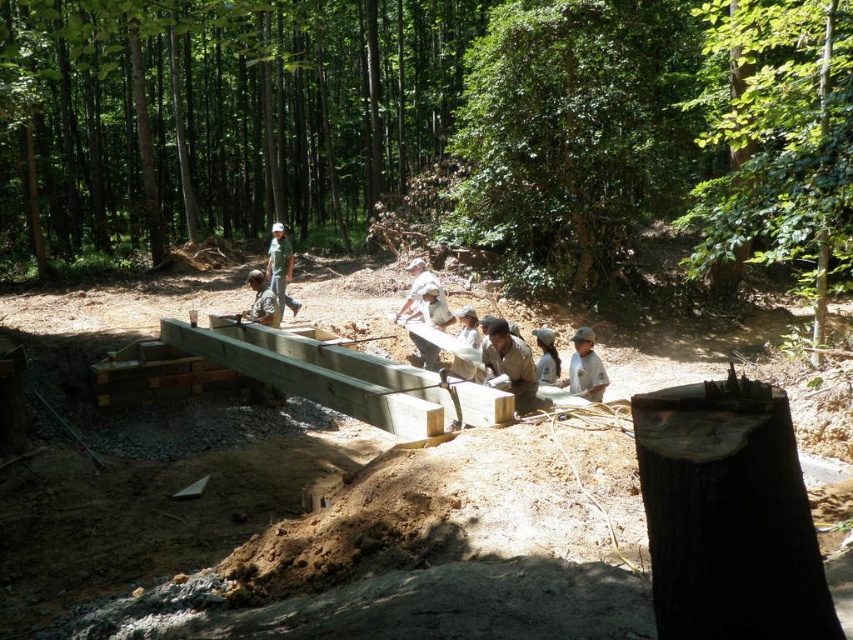
You are planning to take a photo of the green leafy forest at center and the dark brown wood at lower right. Which object should you focus on first if you want to capture both in a single frame without moving the camera?

The green leafy forest at center is bigger than the dark brown wood at lower right, so you should focus on the green leafy forest at center first to ensure it fills the frame appropriately before adjusting for the smaller dark brown wood at lower right.

You are standing in the wooded construction area and want to place a tool on the ground. You have two options for placement marked as point 1 at point (219, 540) and point 2 at point (276, 268). Which point is closer to you?

Point 1 at point (219, 540) is closer to you than point 2 at point (276, 268).

You are a photographer positioned at the edge of the wooded area. You want to capture a photo of the light brown wood at center and the white fabric shirt at center without any obstruction. Based on their positions, which object should you focus on first to ensure both are in the frame?

The light brown wood at center is in front of the white fabric shirt at center, so you should focus on the white fabric shirt at center first to ensure both are visible without obstruction.